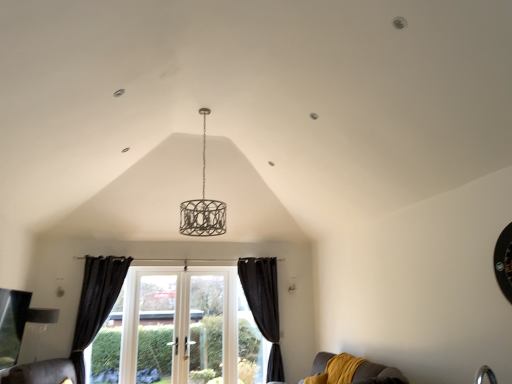
Question: Considering the positions of velvet mustard couch at lower right and matte silver lampshade at lower left in the image, is velvet mustard couch at lower right wider or thinner than matte silver lampshade at lower left?

Choices:
 (A) thin
 (B) wide

Answer: (B)

Question: From the image's perspective, relative to matte silver lampshade at lower left, is velvet mustard couch at lower right above or below?

Choices:
 (A) below
 (B) above

Answer: (A)

Question: Which is nearer to the white glass door at center?

Choices:
 (A) velvet mustard couch at lower right
 (B) black velvet curtain at left, which is counted as the second curtain, starting from the right
 (C) clear glass door at center
 (D) black velvet curtain at lower center, arranged as the second curtain when viewed from the left
 (E) matte silver lampshade at lower left

Answer: (C)

Question: Which of these objects is positioned farthest from the matte silver lampshade at lower left?

Choices:
 (A) black velvet curtain at lower center, which ranks as the first curtain in right-to-left order
 (B) black velvet curtain at left, which appears as the first curtain when viewed from the left
 (C) clear glass door at center
 (D) white glass door at center
 (E) velvet mustard couch at lower right

Answer: (E)